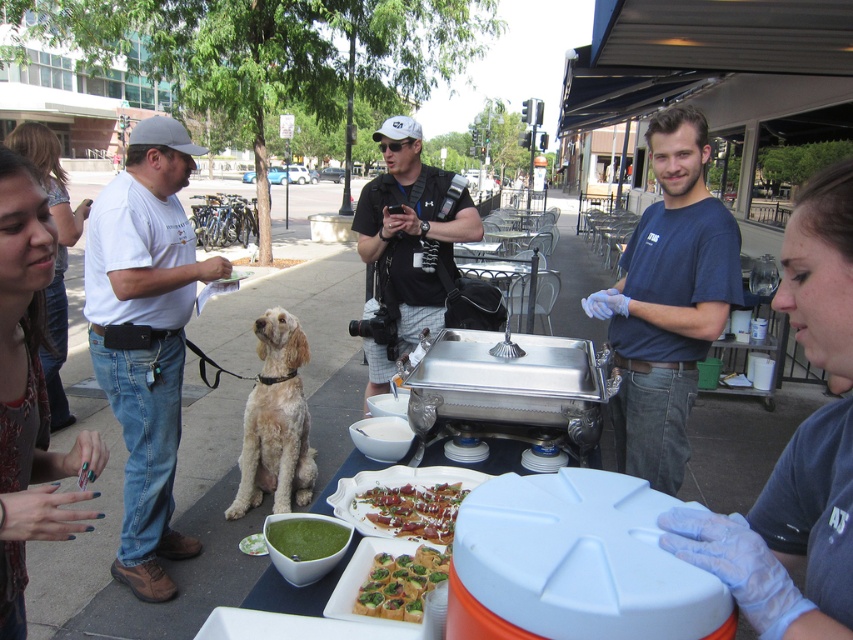
Does point (807, 236) come farther from viewer compared to point (15, 378)?

No, (807, 236) is in front of (15, 378).

How much distance is there between blue latex glove at lower right and green painted nails at lower left?

blue latex glove at lower right and green painted nails at lower left are 4.12 feet apart.

Who is more distant from viewer, [697,518] or [10,184]?

Point [10,184]

This screenshot has height=640, width=853. I want to click on blue latex glove at lower right, so click(x=785, y=536).

Consider the image. Who is more forward, (53, 147) or (424, 564)?

Point (424, 564) is in front.

Does matte black shirt at upper left appear on the right side of green leafymaterial/textureappetizer at center?

Incorrect, matte black shirt at upper left is not on the right side of green leafymaterial/textureappetizer at center.

This screenshot has width=853, height=640. Identify the location of matte black shirt at upper left. (56, 252).

The height and width of the screenshot is (640, 853). In order to click on matte black shirt at upper left in this screenshot , I will do `click(56, 252)`.

Who is shorter, white cotton shirt at left or matte black shirt at upper left?

matte black shirt at upper left is shorter.

Does white cotton shirt at left come in front of matte black shirt at upper left?

That is False.

The width and height of the screenshot is (853, 640). What do you see at coordinates (144, 336) in the screenshot?
I see `white cotton shirt at left` at bounding box center [144, 336].

What are the coordinates of `white cotton shirt at left` in the screenshot? It's located at (144, 336).